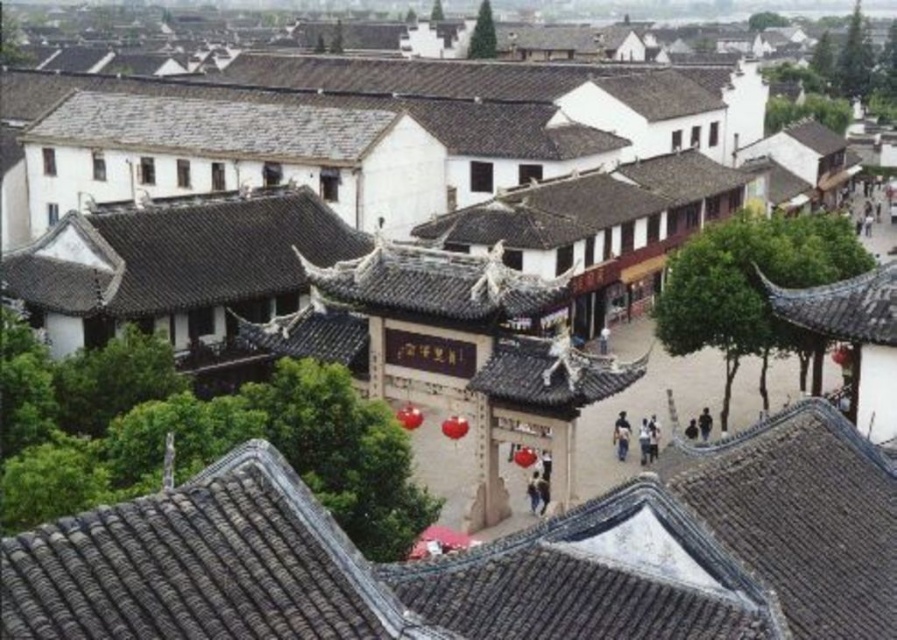
Question: Does gray tile roof at center come behind shiny dark gray roof at upper right?

Choices:
 (A) yes
 (B) no

Answer: (B)

Question: Which point appears closest to the camera in this image?

Choices:
 (A) (385, 602)
 (B) (890, 285)

Answer: (A)

Question: Which of the following is the closest to the observer?

Choices:
 (A) gray tile roof at center
 (B) shiny dark gray roof at upper right

Answer: (A)

Question: From the image, what is the correct spatial relationship of gray tile roof at center in relation to shiny dark gray roof at upper right?

Choices:
 (A) above
 (B) below

Answer: (B)

Question: Is gray tile roof at center to the right of shiny dark gray roof at upper right from the viewer's perspective?

Choices:
 (A) no
 (B) yes

Answer: (A)

Question: Which point is closer to the camera?

Choices:
 (A) gray tile roof at center
 (B) shiny dark gray roof at upper right

Answer: (A)